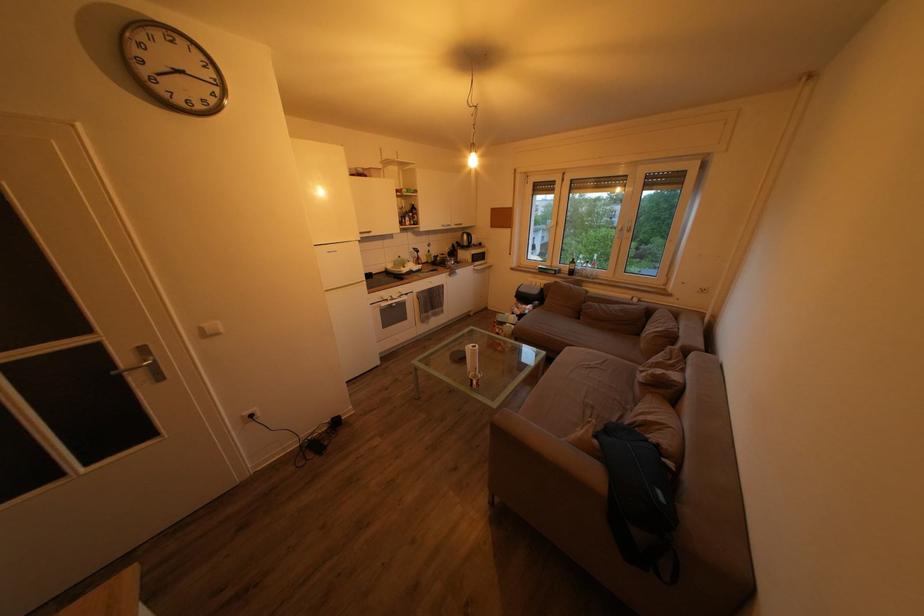
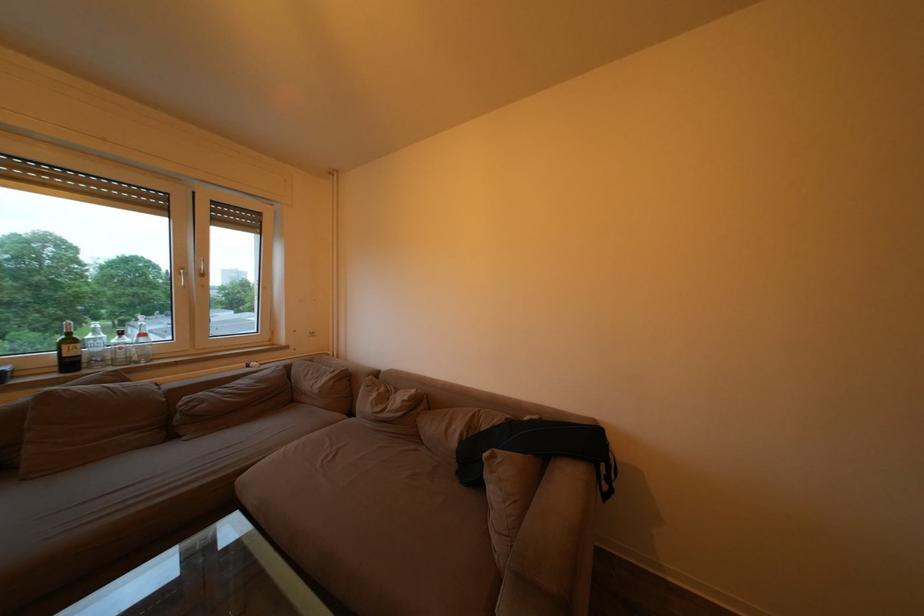
Locate, in the second image, the point that corresponds to the point at 581,268 in the first image.

(79, 347)